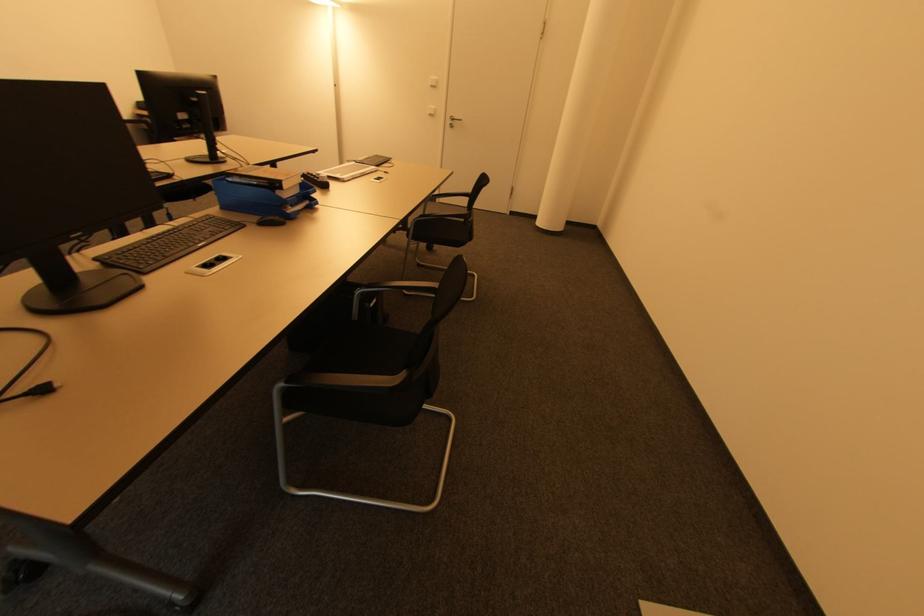
Describe the element at coordinates (362, 350) in the screenshot. I see `the chair sitting surface` at that location.